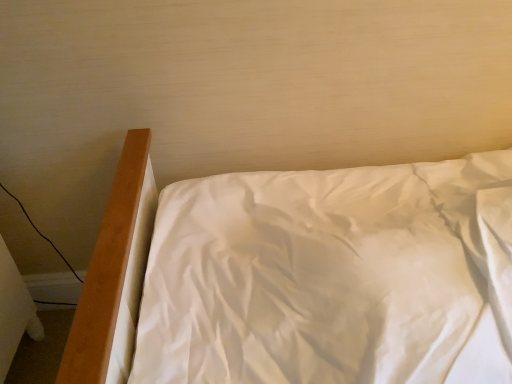
Question: Should I look upward or downward to see white satin bed at center?

Choices:
 (A) down
 (B) up

Answer: (A)